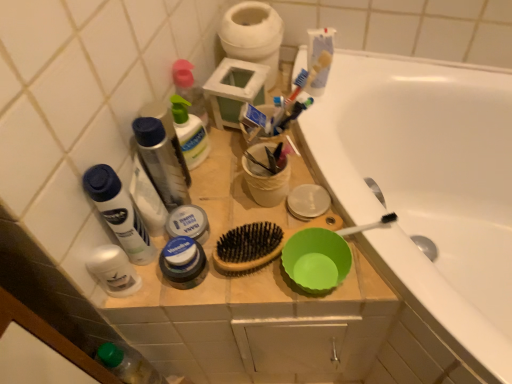
Where is `free space to the back side of white matte jar at center, which is the 3th toiletry in top-to-bottom order`? free space to the back side of white matte jar at center, which is the 3th toiletry in top-to-bottom order is located at coordinates (219, 177).